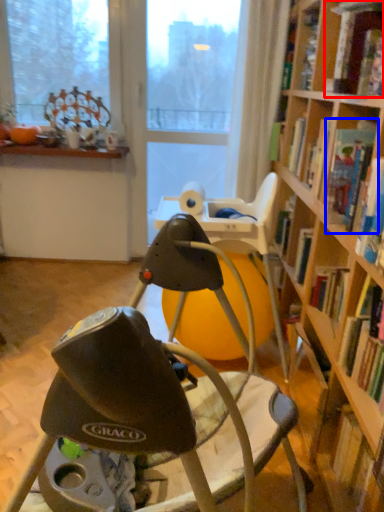
Question: Which point is closer to the camera, book (highlighted by a red box) or book (highlighted by a blue box)?

Choices:
 (A) book
 (B) book

Answer: (A)